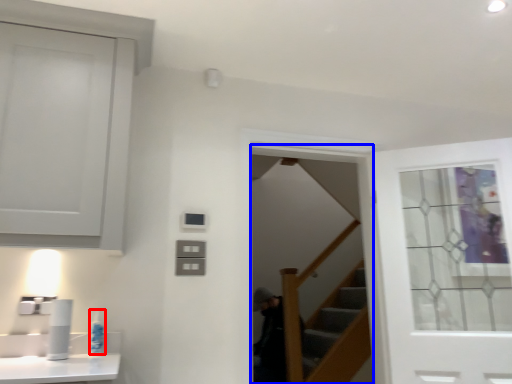
Question: Which of the following is the closest to the observer, toiletry (highlighted by a red box) or screen door (highlighted by a blue box)?

Choices:
 (A) toiletry
 (B) screen door

Answer: (A)